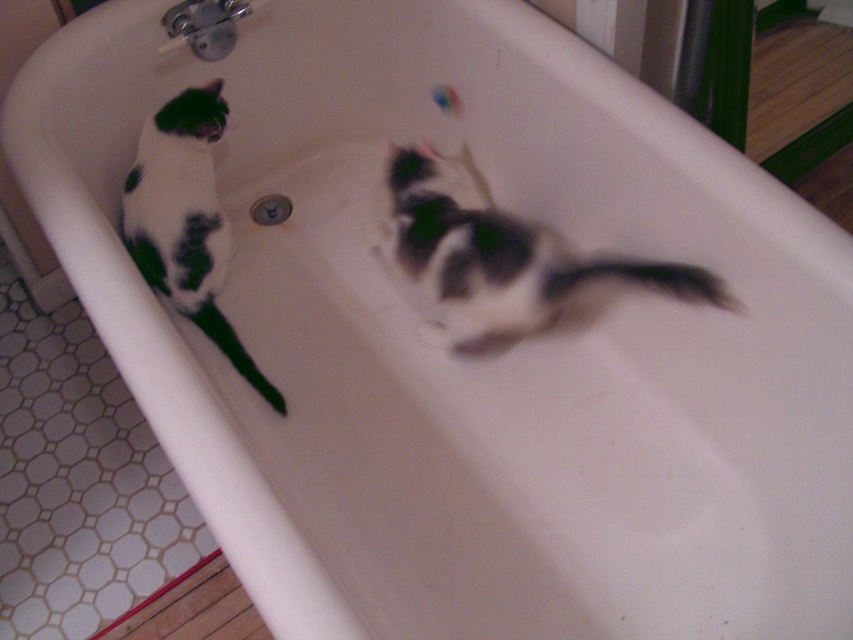
Question: Is black-and-white fur cat at left to the left of black matte tail at left from the viewer's perspective?

Choices:
 (A) yes
 (B) no

Answer: (A)

Question: Is white fur cat at center to the left of black matte tail at left from the viewer's perspective?

Choices:
 (A) yes
 (B) no

Answer: (B)

Question: Which object appears farthest from the camera in this image?

Choices:
 (A) black fur tail at lower right
 (B) black-and-white fur cat at left

Answer: (B)

Question: Which object is the closest to the white fur cat at center?

Choices:
 (A) black matte tail at left
 (B) black-and-white fur cat at left

Answer: (B)

Question: From the image, what is the correct spatial relationship of white fur cat at center in relation to black fur tail at lower right?

Choices:
 (A) left
 (B) right

Answer: (A)

Question: Among these objects, which one is nearest to the camera?

Choices:
 (A) white fur cat at center
 (B) black-and-white fur cat at left
 (C) black fur tail at lower right
 (D) black matte tail at left

Answer: (C)